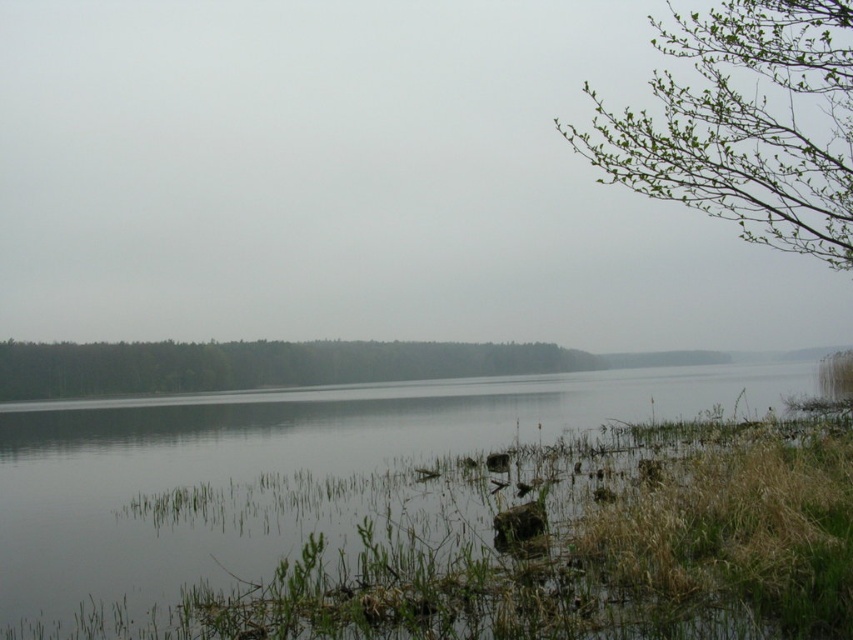
You are standing on the lakeshore and want to take a photo of both the clear water at center and the green leafy forest at center. Which object should you frame first in your camera to ensure both are in the shot?

The clear water at center is positioned on the right side of green leafy forest at center, so you should frame the green leafy forest at center first on the left side of the frame, then include the clear water at center on the right side to capture both in the photo.

You are an artist sketching the lakeside scene. You want to place the green leafy branch at upper right in your drawing. What are the coordinates for its position?

The green leafy branch at upper right should be placed at coordinates 0.197 on the x axis and 0.873 on the y axis.